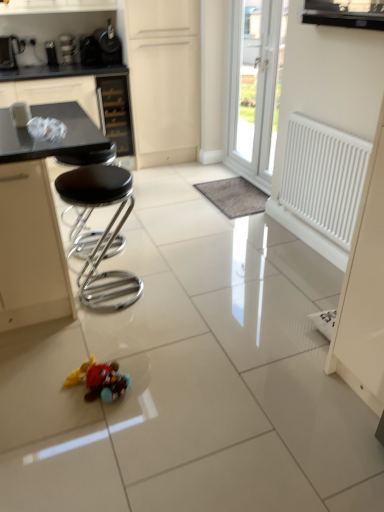
You are a GUI agent. You are given a task and a screenshot of the screen. Output one action in this format:
    pyautogui.click(x=<x>, y=<y>)
    Task: Click on the free spot above white matte radiator at right (from a real-world perspective)
    This screenshot has height=512, width=384.
    Given the screenshot: What is the action you would take?
    pyautogui.click(x=335, y=121)